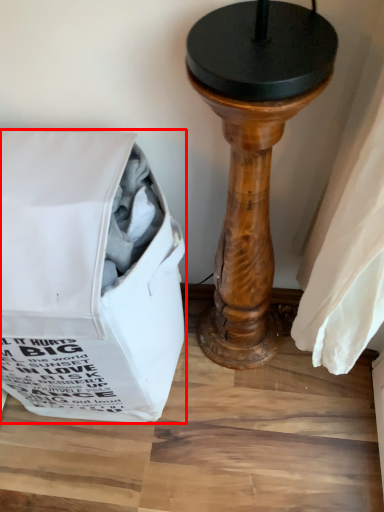
Question: From the image's perspective, where is bag (annotated by the red box) located in relation to furniture in the image?

Choices:
 (A) below
 (B) above

Answer: (A)